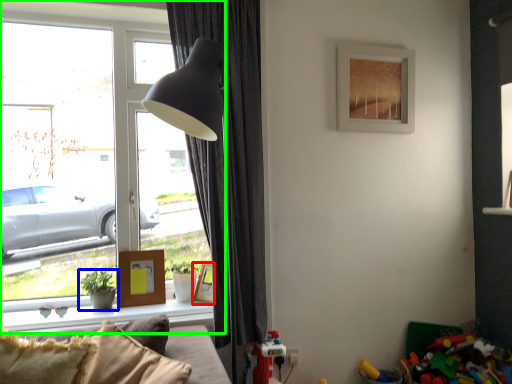
Question: Which object is the farthest from picture frame (highlighted by a red box)? Choose among these: houseplant (highlighted by a blue box) or window (highlighted by a green box).

Choices:
 (A) houseplant
 (B) window

Answer: (B)